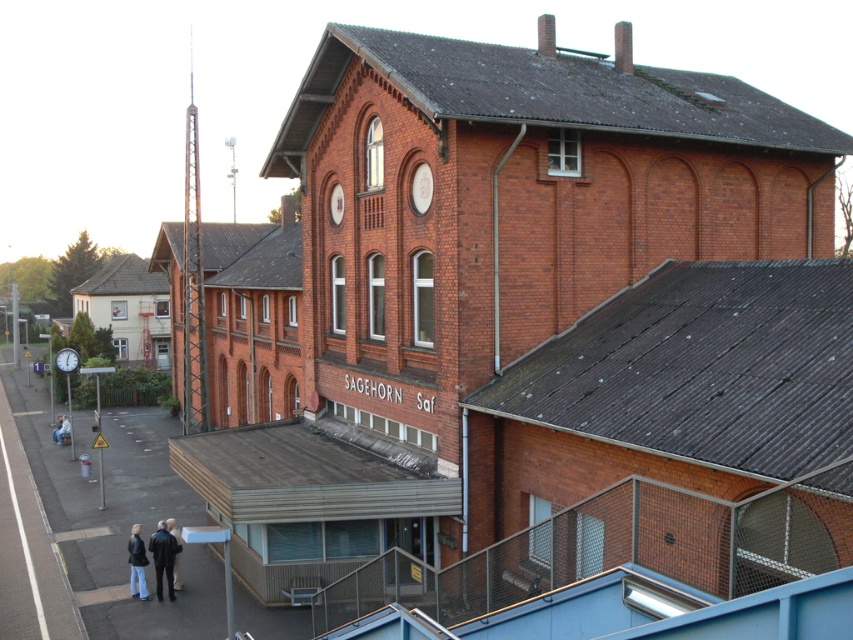
You are a passenger at the SAGEHORN Sat station and want to check the time. You see a metallic round clock at upper left and a dark blue jacket at lower center. Which object is wider?

The metallic round clock at upper left is wider than the dark blue jacket at lower center.

You are standing at the platform in front of the SAGEHORN Sat building. You see a metallic round clock at upper left and a denim jacket at lower left. Which object is positioned more to the right?

The metallic round clock at upper left is positioned more to the right than the denim jacket at lower left.

You are a traveler standing on the platform in front of the SAGEHORN Sat building. You notice a metallic round clock at upper left and a denim jacket at lower left. Which object is taller?

The denim jacket at lower left is taller than the metallic round clock at upper left.